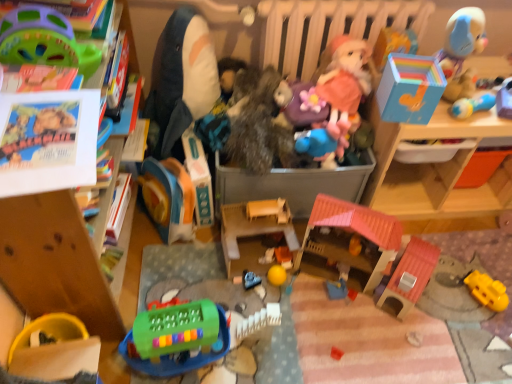
I want to click on vacant area that lies between blue rubber ball at upper right, positioned as the third toy in right-to-left order, and smooth plastic ball at upper right, marked as the 16th toy in a left-to-right arrangement, so click(488, 123).